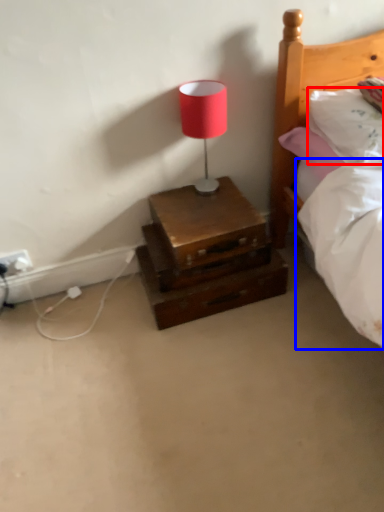
Question: Which object is further to the camera taking this photo, pillow (highlighted by a red box) or mattress (highlighted by a blue box)?

Choices:
 (A) pillow
 (B) mattress

Answer: (B)